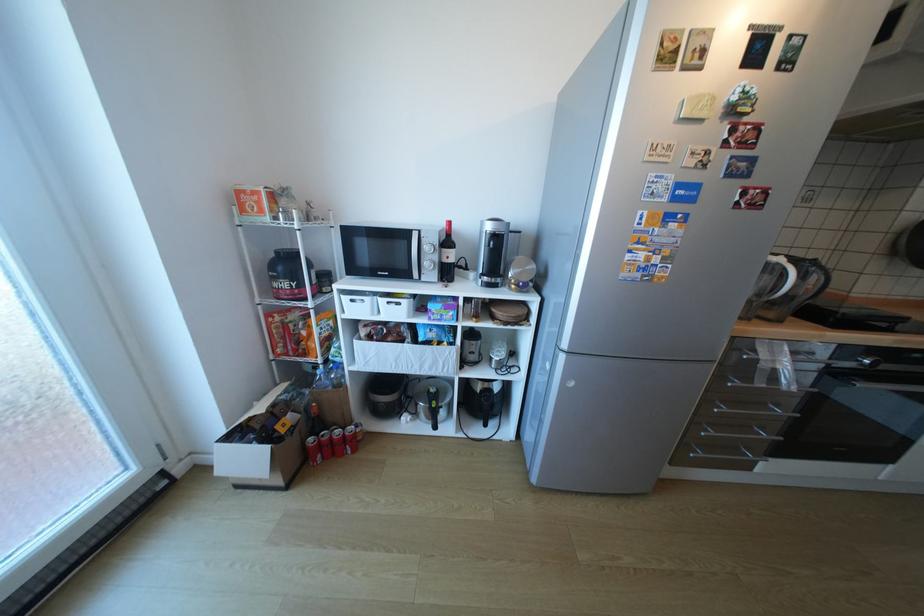
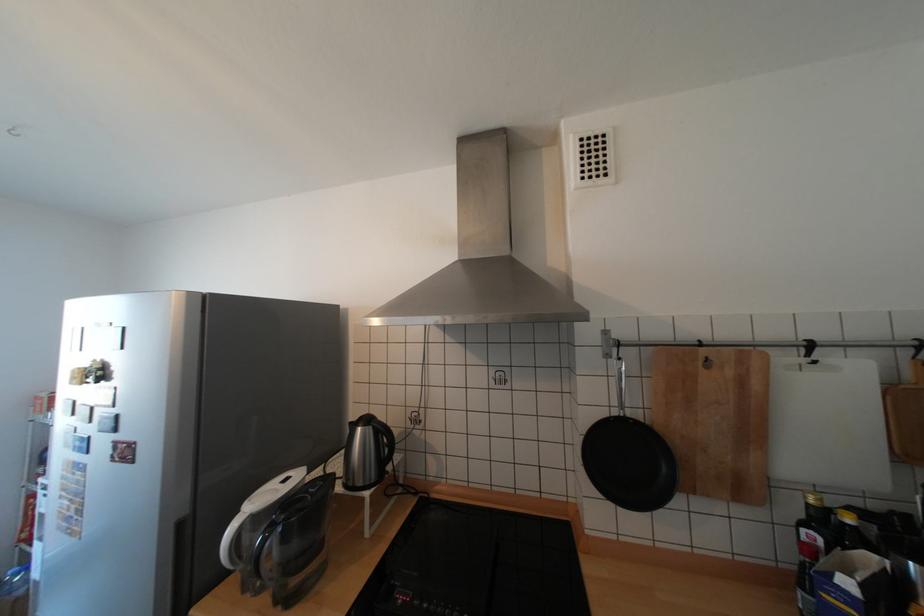
The point at (758, 197) is marked in the first image. Where is the corresponding point in the second image?

(128, 451)